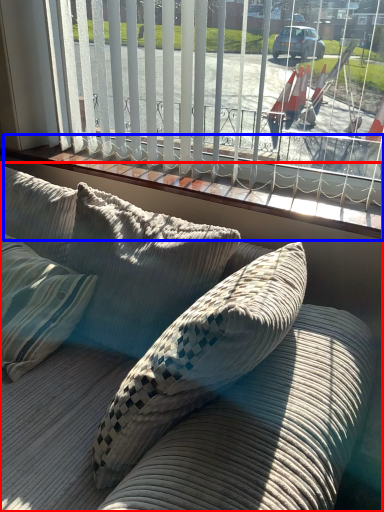
Question: Which object appears closest to the camera in this image, studio couch (highlighted by a red box) or window sill (highlighted by a blue box)?

Choices:
 (A) studio couch
 (B) window sill

Answer: (A)